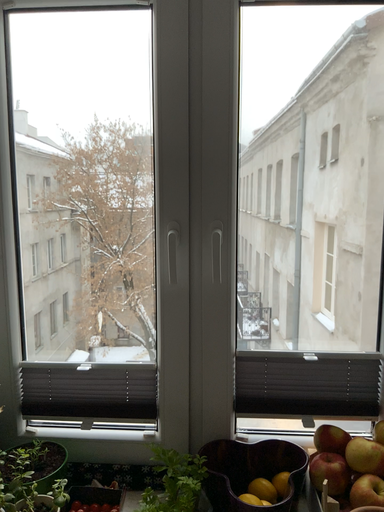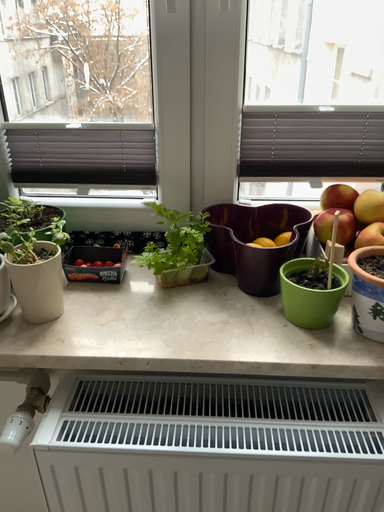
Question: Which way did the camera rotate in the video?

Choices:
 (A) rotated upward
 (B) rotated downward

Answer: (B)